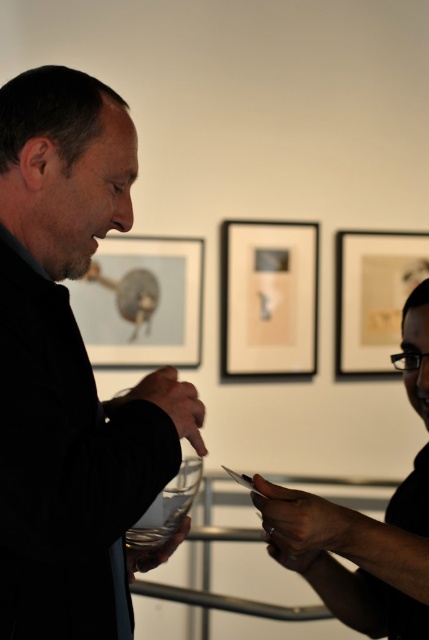
From the picture: You are an art curator planning to install a new sculpture in the center of the room. The sculpture requires a 1.2 meter by 1.2 meter clear space around it. Given the current layout, which object at point (268, 298) is closest to the proposed sculpture location? Is there enough space for the sculpture?

The matte black picture frame at center is located at point (268, 298). Since the sculpture requires a 1.2m x 1.2m clear space around it, and the closest object is the matte black picture frame at center, the distance between them must be at least 0.6 meters. Without specific distance measurements, it is uncertain if there is sufficient space. Further measurements are needed to confirm.

You are standing in an art gallery and want to view the matte glass picture frame at upper left up close. The gallery has a rule that visitors must stay at least 3 feet away from all artworks. Are you currently violating this rule?

The matte glass picture frame at upper left and viewer are 9.05 feet apart from each other, so you are not violating the gallery rule since you are more than 3 feet away.

You are standing in the art gallery and see two points marked in the image. The first point is at coordinates point (262, 304) and the second point is at point (365, 346). Which point is closer to you?

Point (262, 304) is closer to the camera than point (365, 346).